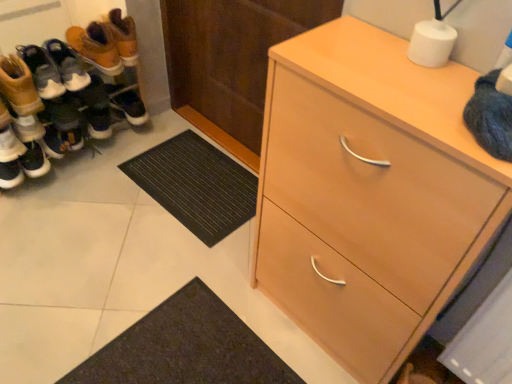
Where is `vacant area on top of black rubber doormat at lower center (from a real-world perspective)`? This screenshot has height=384, width=512. vacant area on top of black rubber doormat at lower center (from a real-world perspective) is located at coordinates (197, 176).